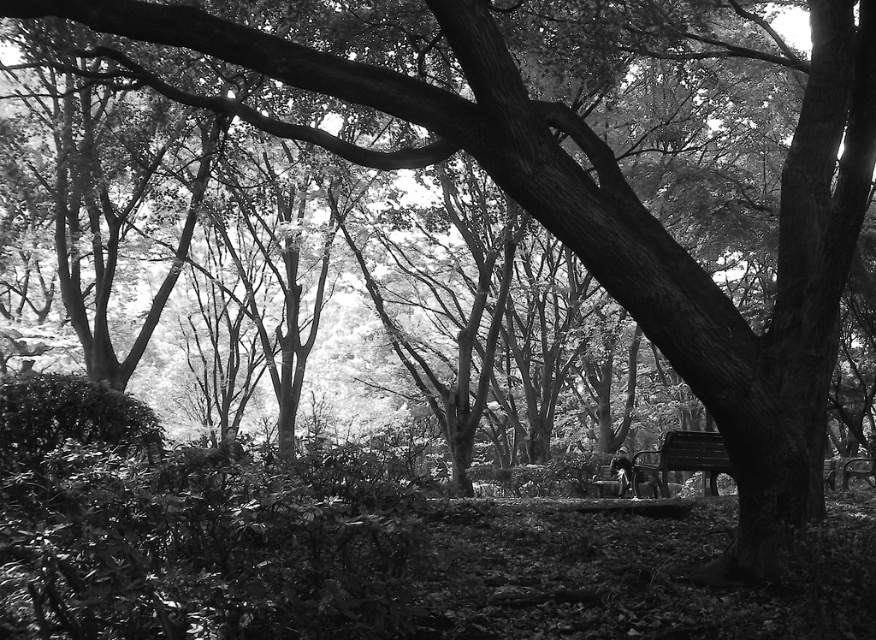
Is wooden bench at center further to camera compared to smooth black jacket at center?

No.

Describe the element at coordinates (682, 460) in the screenshot. I see `wooden bench at center` at that location.

Is point (705, 444) positioned in front of point (624, 488)?

Yes, point (705, 444) is in front of point (624, 488).

Locate an element on the screen. wooden bench at center is located at coordinates (682, 460).